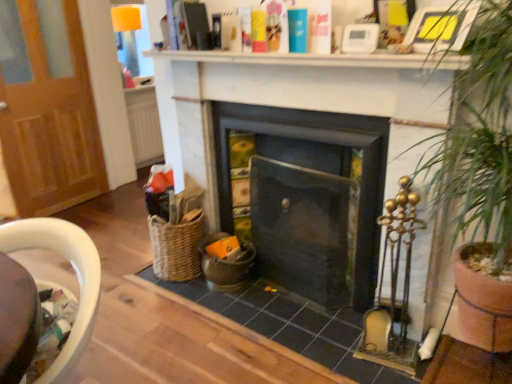
What are the coordinates of `free point in front of woven brown basket at lower left` in the screenshot? It's located at (178, 288).